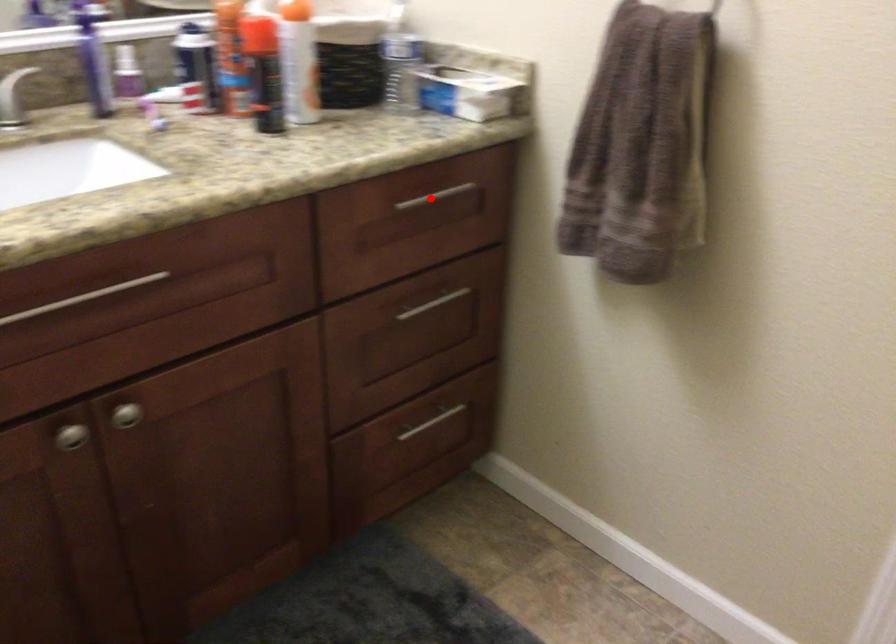
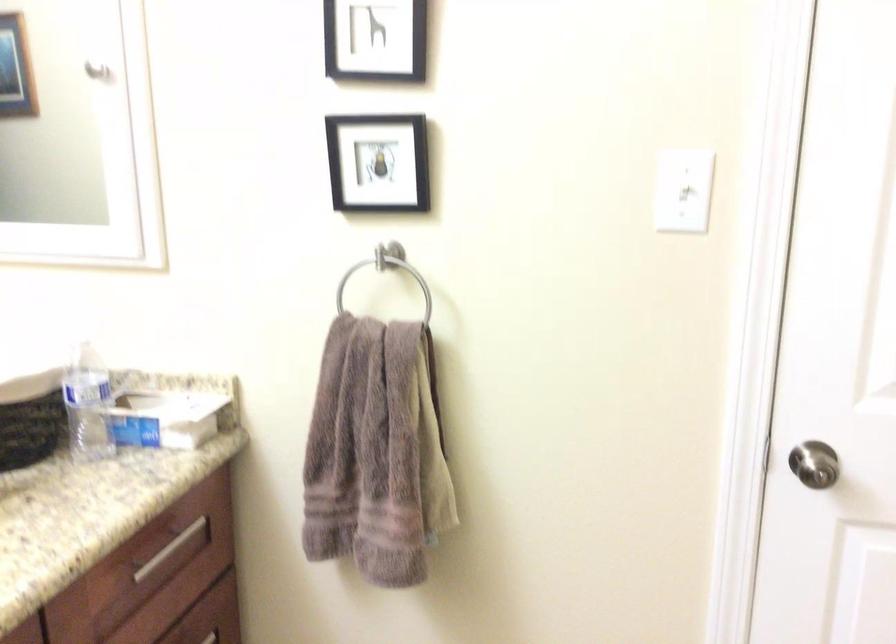
Question: I am providing you with two images of the same scene from different viewpoints. A red point is shown in image1. For the corresponding object point in image2, is it positioned nearer or farther from the camera?

Choices:
 (A) Nearer
 (B) Farther

Answer: (A)